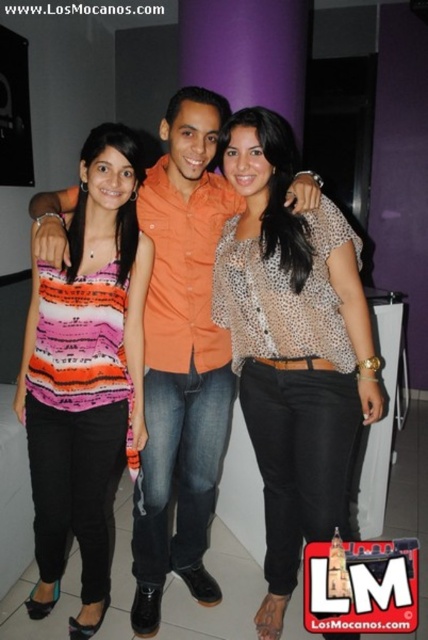
You are at a social event and see two people wearing orange cotton shirt at center and leopard print blouse at center. Which one is positioned to the right?

The leopard print blouse at center is positioned to the right of the orange cotton shirt at center.